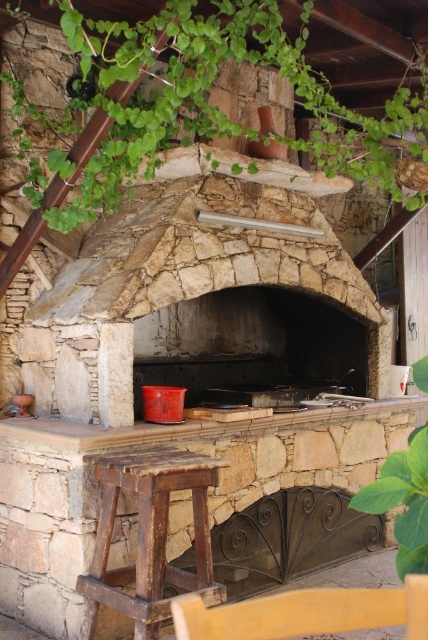
Please provide the 2D coordinates of the dark gray stone fireplace at center in the image. The coordinates should be in the format of a tuple with two decimal numbers separated by a comma, like this example format of the answer would be something like 0.537, 0.584. The answer should be concise and only include the numbers and comma, nothing else.

(249,342)

You are standing in front of the dark gray stone fireplace at center and want to place a pot on the rustic wood stool at lower left. Which direction should you move to reach the stool from the fireplace?

You should move to the left to reach the rustic wood stool at lower left from the dark gray stone fireplace at center because the fireplace is to the right of the stool.